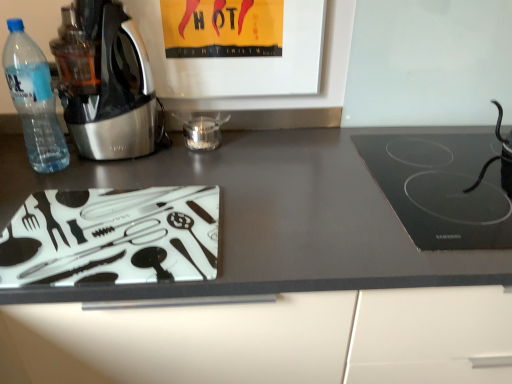
Question: Which direction should I rotate to look at transparent glass jar at center, which is the 2th appliance in right-to-left order?

Choices:
 (A) left
 (B) right

Answer: (A)

Question: Considering the relative sizes of black glass cooktop at right and matte glass cutting board at lower left in the image provided, is black glass cooktop at right thinner than matte glass cutting board at lower left?

Choices:
 (A) no
 (B) yes

Answer: (B)

Question: Can you confirm if black glass cooktop at right is positioned to the right of matte glass cutting board at lower left?

Choices:
 (A) yes
 (B) no

Answer: (A)

Question: Is black glass cooktop at right not within matte glass cutting board at lower left?

Choices:
 (A) no
 (B) yes

Answer: (A)

Question: Is black glass cooktop at right smaller than matte glass cutting board at lower left?

Choices:
 (A) no
 (B) yes

Answer: (B)

Question: Could you tell me if black glass cooktop at right is turned towards matte glass cutting board at lower left?

Choices:
 (A) no
 (B) yes

Answer: (B)

Question: Considering the relative positions of black glass cooktop at right and matte glass cutting board at lower left in the image provided, is black glass cooktop at right to the left of matte glass cutting board at lower left from the viewer's perspective?

Choices:
 (A) no
 (B) yes

Answer: (A)

Question: Considering the relative sizes of transparent plastic bottle at left and transparent glass jar at center, which is the 2th appliance in right-to-left order, in the image provided, is transparent plastic bottle at left thinner than transparent glass jar at center, which is the 2th appliance in right-to-left order,?

Choices:
 (A) no
 (B) yes

Answer: (A)

Question: Are transparent plastic bottle at left and transparent glass jar at center, arranged as the first appliance when viewed from the left, located far from each other?

Choices:
 (A) no
 (B) yes

Answer: (A)

Question: Is transparent plastic bottle at left not within transparent glass jar at center, arranged as the first appliance when viewed from the left?

Choices:
 (A) yes
 (B) no

Answer: (A)

Question: From the image's perspective, does transparent plastic bottle at left appear higher than transparent glass jar at center, which is the 2th appliance in right-to-left order?

Choices:
 (A) no
 (B) yes

Answer: (B)

Question: Considering the relative positions of transparent plastic bottle at left and transparent glass jar at center, arranged as the first appliance when viewed from the left, in the image provided, is transparent plastic bottle at left to the left of transparent glass jar at center, arranged as the first appliance when viewed from the left, from the viewer's perspective?

Choices:
 (A) no
 (B) yes

Answer: (B)

Question: From a real-world perspective, is transparent plastic bottle at left below transparent glass jar at center, arranged as the first appliance when viewed from the left?

Choices:
 (A) yes
 (B) no

Answer: (B)

Question: Is metallic stainless steel kettle at left facing towards transparent plastic bottle at left?

Choices:
 (A) yes
 (B) no

Answer: (B)